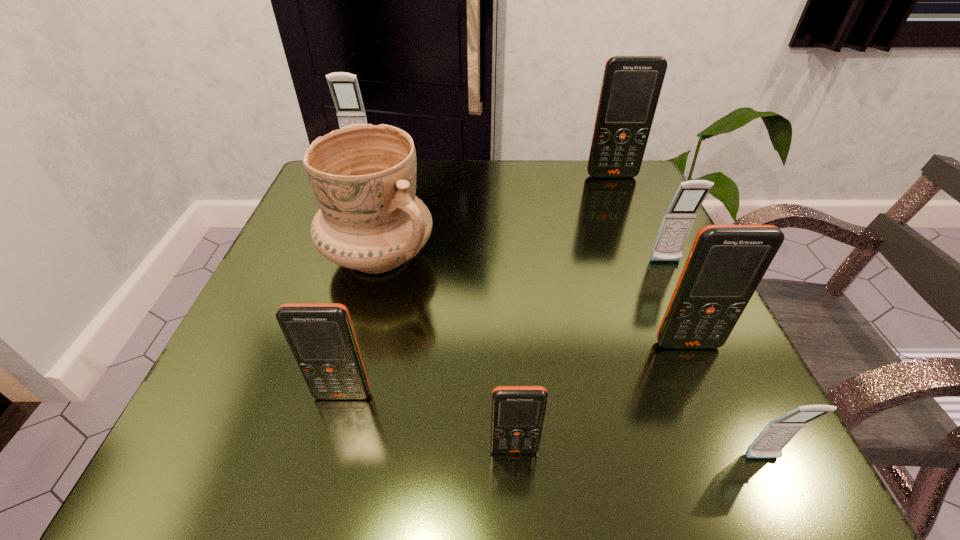
Where is `the tallest object`? This screenshot has height=540, width=960. the tallest object is located at coordinates (631, 86).

In order to click on the tallest cellular telephone in this screenshot , I will do `click(631, 86)`.

This screenshot has height=540, width=960. I want to click on the farthest cellular telephone, so click(344, 87).

In order to click on the leftmost gray cellular telephone in this screenshot , I will do `click(344, 87)`.

Find the location of a particular element. the third nearest orange cellular telephone is located at coordinates (726, 263).

The height and width of the screenshot is (540, 960). What are the coordinates of `the fifth farthest object` in the screenshot? It's located at tap(726, 263).

Where is `beige pottery`? The image size is (960, 540). beige pottery is located at coordinates (363, 176).

Where is `the second biggest gray cellular telephone`? The width and height of the screenshot is (960, 540). the second biggest gray cellular telephone is located at coordinates (678, 219).

You are a GUI agent. You are given a task and a screenshot of the screen. Output one action in this format:
    pyautogui.click(x=<x>, y=<y>)
    Task: Click on the third farthest cellular telephone
    The width and height of the screenshot is (960, 540).
    Given the screenshot: What is the action you would take?
    pyautogui.click(x=678, y=219)

Find the location of `the second smallest orange cellular telephone`. the second smallest orange cellular telephone is located at coordinates (321, 337).